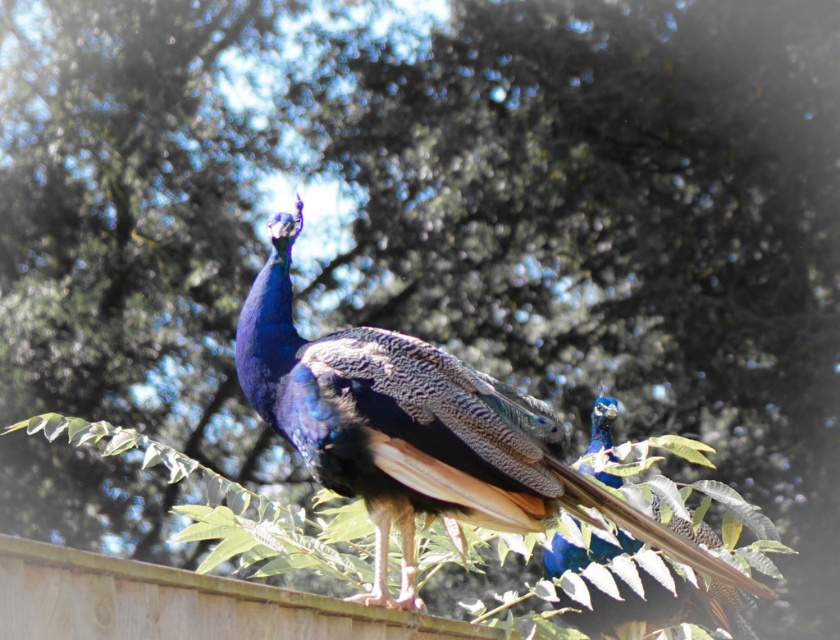
Question: Does shiny blue peacock at center appear over shiny blue peacock at upper right?

Choices:
 (A) yes
 (B) no

Answer: (A)

Question: Where is shiny blue peacock at center located in relation to shiny blue peacock at upper right in the image?

Choices:
 (A) left
 (B) right

Answer: (A)

Question: Can you confirm if shiny blue peacock at center is positioned above shiny blue peacock at upper right?

Choices:
 (A) no
 (B) yes

Answer: (B)